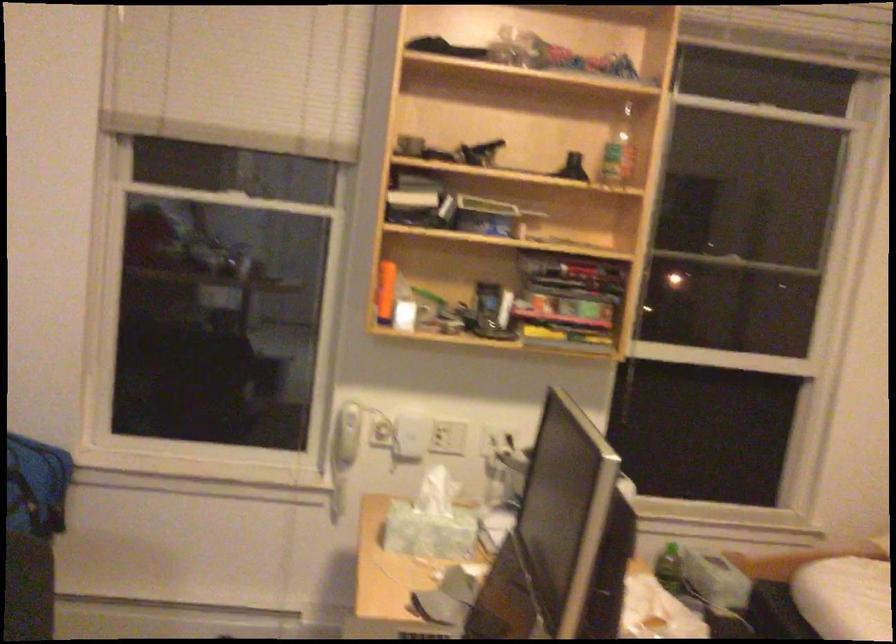
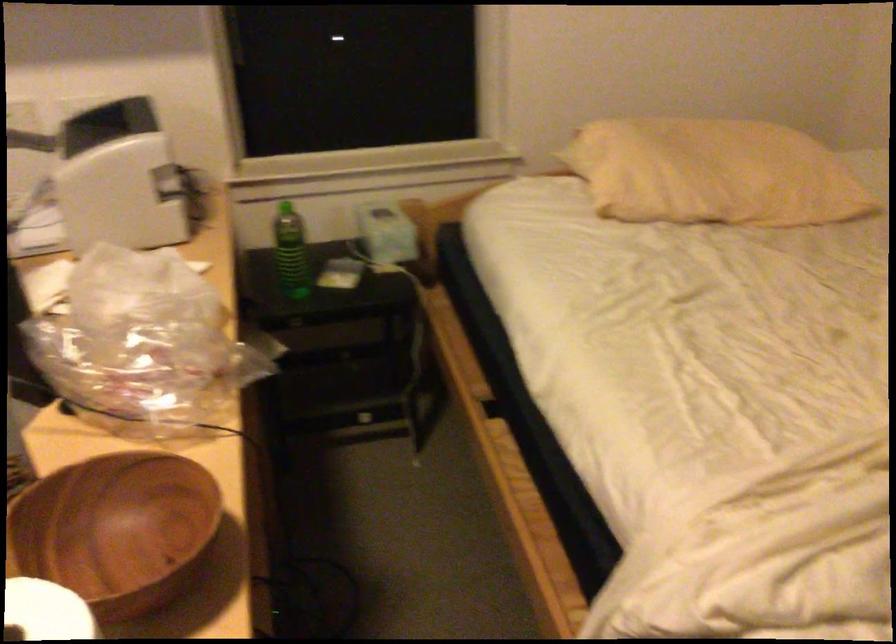
Question: The first image is from the beginning of the video and the second image is from the end. How did the camera likely rotate when shooting the video?

Choices:
 (A) Left
 (B) Right
 (C) Up
 (D) Down

Answer: (D)